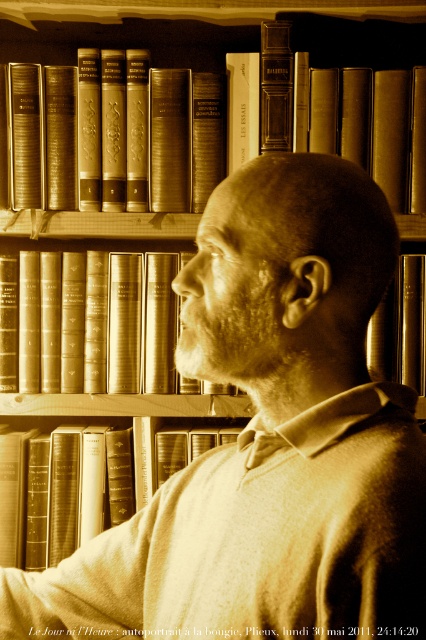
Question: Which of these objects is positioned farthest from the hardcover book at center?

Choices:
 (A) sepia leather book at center
 (B) hardcover book at upper center

Answer: (B)

Question: Which object appears farthest from the camera in this image?

Choices:
 (A) hardcover book at center
 (B) hardcover book at upper center

Answer: (A)

Question: Does sepia leather book at center appear on the left side of hardcover book at upper center?

Choices:
 (A) yes
 (B) no

Answer: (A)

Question: Can you confirm if sepia leather book at center is bigger than hardcover book at center?

Choices:
 (A) yes
 (B) no

Answer: (B)

Question: Is sepia leather book at center below hardcover book at upper center?

Choices:
 (A) yes
 (B) no

Answer: (A)

Question: Which object is positioned closest to the hardcover book at center?

Choices:
 (A) sepia leather book at center
 (B) hardcover book at upper center

Answer: (A)